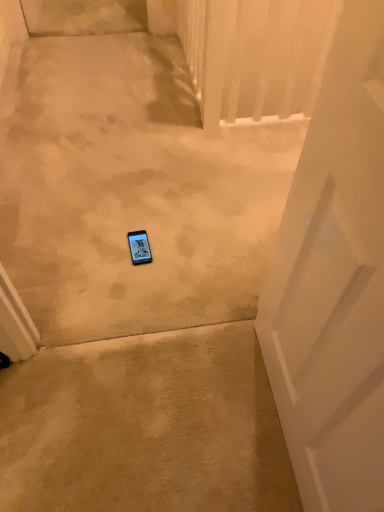
Locate an element on the screen. white matte door at center is located at coordinates (334, 282).

What do you see at coordinates (334, 282) in the screenshot?
I see `white matte door at center` at bounding box center [334, 282].

Locate an element on the screen. matte black phone at center is located at coordinates (139, 247).

Measure the distance between matte black phone at center and camera.

matte black phone at center and camera are 5.24 feet apart.

What do you see at coordinates (139, 247) in the screenshot? I see `matte black phone at center` at bounding box center [139, 247].

At what (x,y) coordinates should I click in order to perform the action: click on white matte door at center. Please return your answer as a coordinate pair (x, y). This screenshot has width=384, height=512. Looking at the image, I should click on (334, 282).

Does matte black phone at center appear on the right side of white matte door at center?

No.

From the picture: Considering the positions of objects matte black phone at center and white matte door at center in the image provided, who is behind, matte black phone at center or white matte door at center?

matte black phone at center.

Does point (151, 254) come in front of point (359, 441)?

That is False.

From the image's perspective, which one is positioned higher, matte black phone at center or white matte door at center?

matte black phone at center appears higher in the image.

From a real-world perspective, who is located lower, matte black phone at center or white matte door at center?

In real-world perspective, matte black phone at center is lower.

Considering the sizes of objects matte black phone at center and white matte door at center in the image provided, who is wider, matte black phone at center or white matte door at center?

Wider between the two is matte black phone at center.

From the picture: Is matte black phone at center shorter than white matte door at center?

Answer: Yes, matte black phone at center is shorter than white matte door at center.

Considering the sizes of objects matte black phone at center and white matte door at center in the image provided, who is smaller, matte black phone at center or white matte door at center?

matte black phone at center.

Is matte black phone at center spatially inside white matte door at center, or outside of it?

matte black phone at center is outside white matte door at center.

Is matte black phone at center far from white matte door at center?

matte black phone at center is actually quite close to white matte door at center.

Is matte black phone at center aimed at white matte door at center?

No.

This screenshot has width=384, height=512. I want to click on door in front of the matte black phone at center, so click(334, 282).

Which object is positioned more to the right, white matte door at center or matte black phone at center?

white matte door at center.

Which object is closer to the camera, white matte door at center or matte black phone at center?

white matte door at center is closer to the camera.

Which is behind, point (373, 422) or point (149, 261)?

The point (149, 261) is more distant.

From the image's perspective, is white matte door at center located above matte black phone at center?

No, from the image's perspective, white matte door at center is not over matte black phone at center.

From a real-world perspective, which object stands above the other?

white matte door at center.

Between white matte door at center and matte black phone at center, which one has smaller width?

white matte door at center.

In terms of height, does white matte door at center look taller or shorter compared to matte black phone at center?

white matte door at center is taller than matte black phone at center.

Is white matte door at center smaller than matte black phone at center?

Incorrect, white matte door at center is not smaller in size than matte black phone at center.

Choose the correct answer: Is white matte door at center inside matte black phone at center or outside it?

The correct answer is: outside.

Does white matte door at center touch matte black phone at center?

There is a gap between white matte door at center and matte black phone at center.

Does white matte door at center turn towards matte black phone at center?

No, white matte door at center is not aimed at matte black phone at center.

From the picture: How different are the orientations of white matte door at center and matte black phone at center in degrees?

The angle between the facing direction of white matte door at center and the facing direction of matte black phone at center is 176 degrees.

How far apart are white matte door at center and matte black phone at center?

34.49 inches.

The image size is (384, 512). In order to click on gadget to the left of white matte door at center in this screenshot , I will do `click(139, 247)`.

Where is `gadget on the left side of white matte door at center`? This screenshot has height=512, width=384. gadget on the left side of white matte door at center is located at coordinates (139, 247).

Locate an element on the screen. gadget below the white matte door at center (from a real-world perspective) is located at coordinates (139, 247).